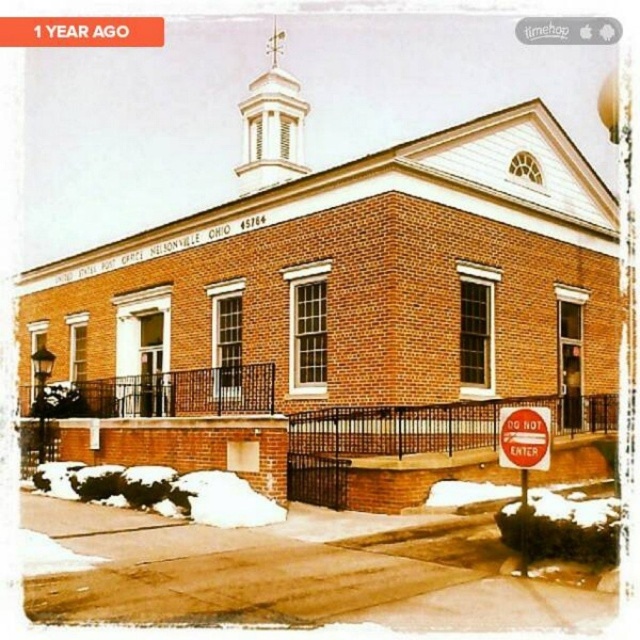
Can you confirm if white smooth spire at upper center is positioned to the right of red matte stop sign at lower right?

No, white smooth spire at upper center is not to the right of red matte stop sign at lower right.

Is white smooth spire at upper center taller than red matte stop sign at lower right?

Correct, white smooth spire at upper center is much taller as red matte stop sign at lower right.

Looking at this image, who is more forward, (x=273, y=141) or (x=516, y=410)?

Positioned in front is point (x=516, y=410).

This screenshot has height=640, width=640. Find the location of `white smooth spire at upper center`. white smooth spire at upper center is located at coordinates (272, 125).

Is brick building at center to the right of red matte stop sign at lower right from the viewer's perspective?

Incorrect, brick building at center is not on the right side of red matte stop sign at lower right.

Find the location of a particular element. brick building at center is located at coordinates (324, 216).

This screenshot has width=640, height=640. What are the coordinates of `brick building at center` in the screenshot? It's located at (324, 216).

Which is behind, point (291, 179) or point (532, 467)?

The point (291, 179) is more distant.

Is white smooth spire at upper center below red plastic sign at lower right?

Actually, white smooth spire at upper center is above red plastic sign at lower right.

Which is in front, point (289, 125) or point (522, 467)?

Positioned in front is point (522, 467).

This screenshot has height=640, width=640. Identify the location of white smooth spire at upper center. (272, 125).